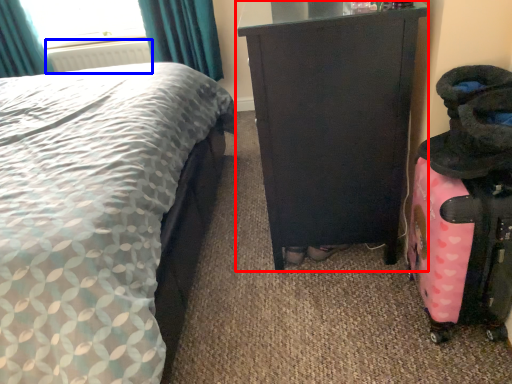
Question: Which object is further to the camera taking this photo, furniture (highlighted by a red box) or radiator (highlighted by a blue box)?

Choices:
 (A) furniture
 (B) radiator

Answer: (B)